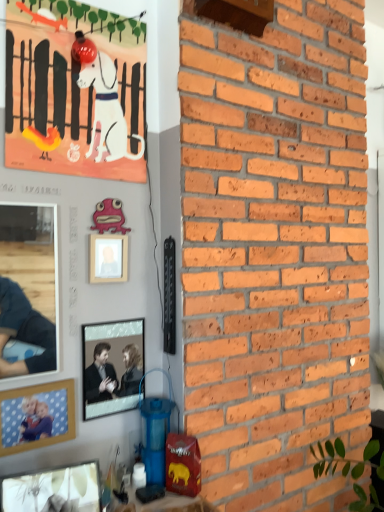
Question: From a real-world perspective, is matte paper poster at upper left under pink wood picture frame at upper center, arranged as the 1th picture frame when viewed from the back?

Choices:
 (A) yes
 (B) no

Answer: (B)

Question: Considering the relative sizes of matte paper poster at upper left and pink wood picture frame at upper center, marked as the 4th picture frame in a bottom-to-top arrangement, in the image provided, is matte paper poster at upper left shorter than pink wood picture frame at upper center, marked as the 4th picture frame in a bottom-to-top arrangement,?

Choices:
 (A) yes
 (B) no

Answer: (B)

Question: Can you confirm if matte paper poster at upper left is thinner than pink wood picture frame at upper center, arranged as the 1th picture frame when viewed from the back?

Choices:
 (A) no
 (B) yes

Answer: (B)

Question: Is matte paper poster at upper left far from pink wood picture frame at upper center, arranged as the first picture frame when viewed from the top?

Choices:
 (A) no
 (B) yes

Answer: (A)

Question: Can you confirm if matte paper poster at upper left is smaller than pink wood picture frame at upper center, marked as the 4th picture frame in a bottom-to-top arrangement?

Choices:
 (A) yes
 (B) no

Answer: (B)

Question: Is matte glass picture frame at lower left, which is counted as the fourth picture frame, starting from the top, wider or thinner than matte paper poster at upper left?

Choices:
 (A) thin
 (B) wide

Answer: (B)

Question: Considering the positions of point (99, 501) and point (16, 27), is point (99, 501) closer or farther from the camera than point (16, 27)?

Choices:
 (A) closer
 (B) farther

Answer: (A)

Question: Looking at the image, does matte glass picture frame at lower left, which ranks as the first picture frame in front-to-back order, seem bigger or smaller compared to matte paper poster at upper left?

Choices:
 (A) big
 (B) small

Answer: (B)

Question: Relative to matte paper poster at upper left, is matte glass picture frame at lower left, the 1th picture frame when ordered from bottom to top, in front or behind?

Choices:
 (A) behind
 (B) front

Answer: (B)

Question: Is metallic silver picture frame at center, which is the 3th picture frame in bottom-to-top order, wider or thinner than pink wood picture frame at upper center, marked as the 4th picture frame in a bottom-to-top arrangement?

Choices:
 (A) wide
 (B) thin

Answer: (B)

Question: Which is correct: metallic silver picture frame at center, which ranks as the 3th picture frame in front-to-back order, is inside pink wood picture frame at upper center, arranged as the first picture frame when viewed from the top, or outside of it?

Choices:
 (A) inside
 (B) outside

Answer: (B)

Question: Considering the positions of metallic silver picture frame at center, which appears as the 2th picture frame when viewed from the back, and pink wood picture frame at upper center, which is the 4th picture frame in front-to-back order, in the image, is metallic silver picture frame at center, which appears as the 2th picture frame when viewed from the back, bigger or smaller than pink wood picture frame at upper center, which is the 4th picture frame in front-to-back order,?

Choices:
 (A) small
 (B) big

Answer: (A)

Question: From the image's perspective, is metallic silver picture frame at center, the 2th picture frame in the top-to-bottom sequence, positioned above or below pink wood picture frame at upper center, arranged as the first picture frame when viewed from the top?

Choices:
 (A) below
 (B) above

Answer: (A)

Question: Is point [x=97, y=408] closer or farther from the camera than point [x=86, y=497]?

Choices:
 (A) farther
 (B) closer

Answer: (A)

Question: Considering the positions of metallic silver picture frame at center, which appears as the 2th picture frame when viewed from the back, and matte glass picture frame at lower left, the 1th picture frame when ordered from bottom to top, in the image, is metallic silver picture frame at center, which appears as the 2th picture frame when viewed from the back, taller or shorter than matte glass picture frame at lower left, the 1th picture frame when ordered from bottom to top,?

Choices:
 (A) tall
 (B) short

Answer: (A)